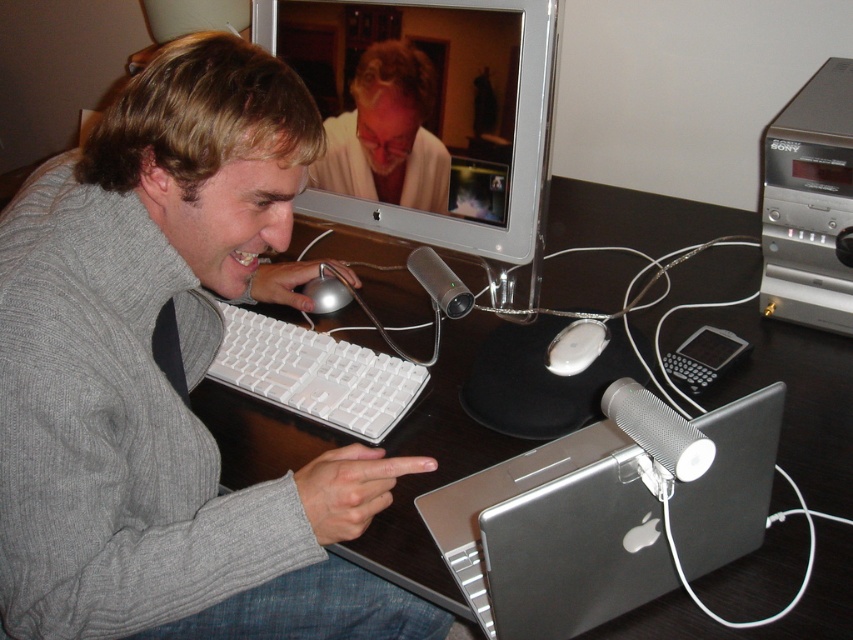
You are standing in front of the desk and want to touch the point at coordinates point (148,512). If your hand can reach up to 30 inches, will you be able to reach it?

The point (148,512) is 30.41 inches away from the viewer. Since your hand can only reach up to 30 inches, you will not be able to reach the point (148,512).

You are a photographer standing in front of the scene. You want to take a photo of the gray sweater at center and the silver metallic desktop computer at upper right. Which object should you focus on first if you want to capture both in focus without moving the camera?

The gray sweater at center is below the silver metallic desktop computer at upper right, so focusing on the gray sweater at center first would ensure both are in focus since it is closer to the camera.

You are a delivery person trying to place a small package on the desk between the gray sweater at center and the silver metallic desktop computer at upper right. Can you fit it there?

The distance between the gray sweater at center and the silver metallic desktop computer at upper right is 27.67 inches, so yes, the small package can fit in the space between them.